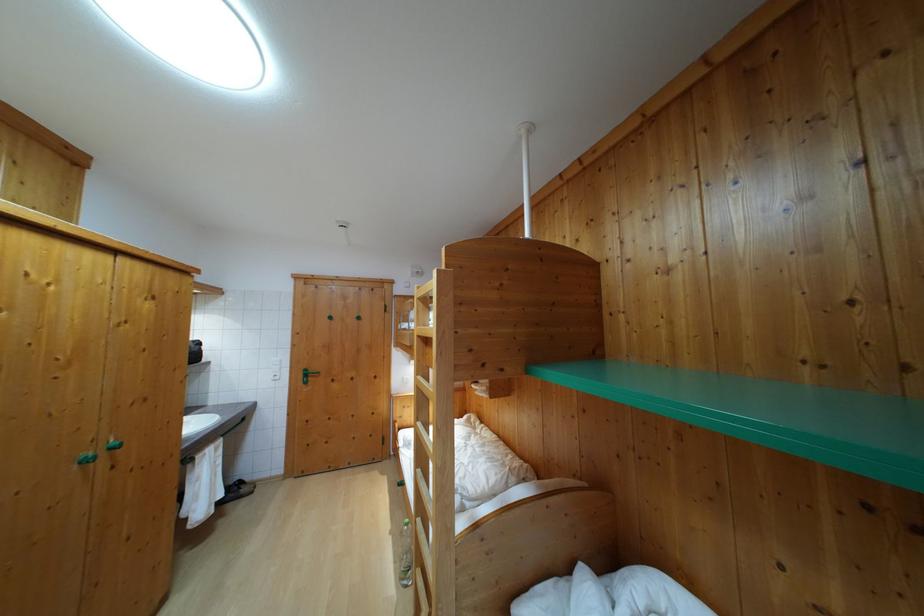
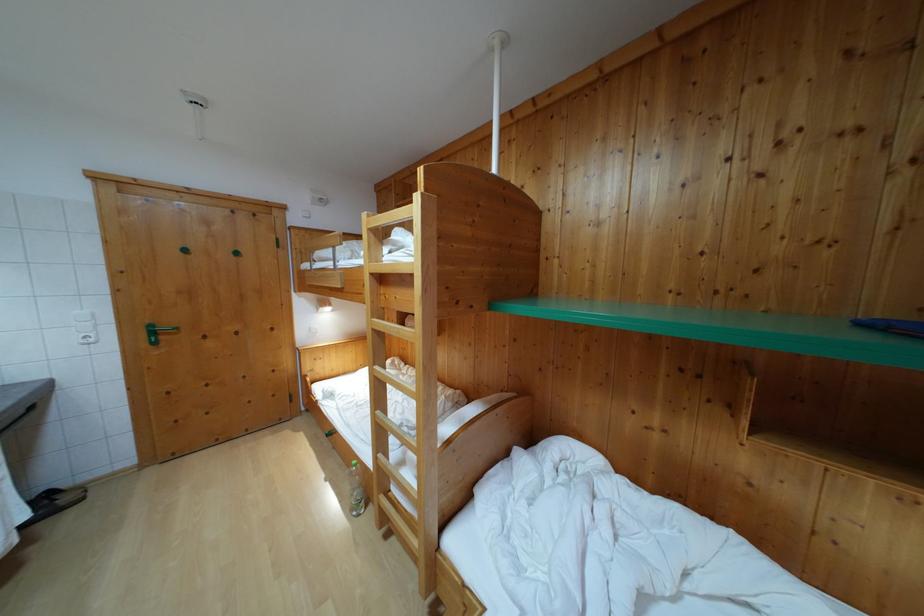
Where in the second image is the point corresponding to point 310,377 from the first image?

(155, 333)